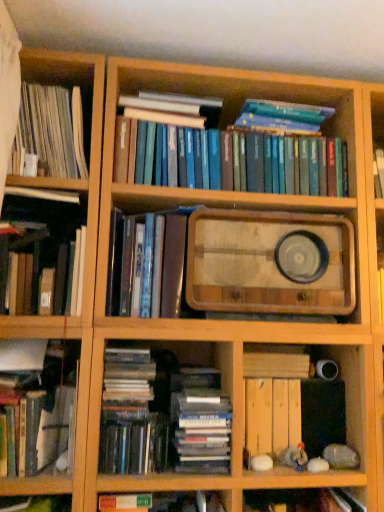
Question: Is hardcover books at center, the third book when ordered from bottom to top, to the left of hardcover book at lower left, the 2th book in the bottom-to-top sequence, from the viewer's perspective?

Choices:
 (A) no
 (B) yes

Answer: (A)

Question: Is hardcover books at center, the 5th book from the top, behind hardcover book at lower left, which is counted as the sixth book, starting from the top?

Choices:
 (A) no
 (B) yes

Answer: (B)

Question: From a real-world perspective, is hardcover books at center, the 5th book from the top, located higher than hardcover book at lower left, which is counted as the sixth book, starting from the top?

Choices:
 (A) yes
 (B) no

Answer: (A)

Question: From the image's perspective, is hardcover books at center, the third book when ordered from bottom to top, above hardcover book at lower left, which is counted as the sixth book, starting from the top?

Choices:
 (A) no
 (B) yes

Answer: (B)

Question: Is hardcover book at lower left, the 2th book in the bottom-to-top sequence, inside hardcover books at center, the 5th book from the top?

Choices:
 (A) no
 (B) yes

Answer: (A)

Question: Considering the relative sizes of hardcover books at center, the third book when ordered from bottom to top, and hardcover book at lower left, which is counted as the sixth book, starting from the top, in the image provided, is hardcover books at center, the third book when ordered from bottom to top, bigger than hardcover book at lower left, which is counted as the sixth book, starting from the top,?

Choices:
 (A) yes
 (B) no

Answer: (A)

Question: From the image's perspective, is shiny metallic book at center, which ranks as the 4th book in top-to-bottom order, located above hardcover books at center, the 5th book from the top?

Choices:
 (A) yes
 (B) no

Answer: (A)

Question: Does shiny metallic book at center, which ranks as the 4th book in top-to-bottom order, turn towards hardcover books at center, the 5th book from the top?

Choices:
 (A) yes
 (B) no

Answer: (B)

Question: From the image's perspective, does shiny metallic book at center, which ranks as the 4th book in top-to-bottom order, appear lower than hardcover books at center, the 5th book from the top?

Choices:
 (A) yes
 (B) no

Answer: (B)

Question: Does shiny metallic book at center, which ranks as the 4th book in top-to-bottom order, have a lesser height compared to hardcover books at center, the 5th book from the top?

Choices:
 (A) no
 (B) yes

Answer: (A)

Question: Does shiny metallic book at center, which ranks as the 4th book in top-to-bottom order, have a larger size compared to hardcover books at center, the 5th book from the top?

Choices:
 (A) yes
 (B) no

Answer: (A)

Question: From a real-world perspective, is shiny metallic book at center, the fourth book when ordered from bottom to top, physically below hardcover books at center, the 5th book from the top?

Choices:
 (A) yes
 (B) no

Answer: (B)

Question: Considering the relative positions of wooden tray at center and shiny black book at lower left, the seventh book positioned from the top, in the image provided, is wooden tray at center to the left of shiny black book at lower left, the seventh book positioned from the top, from the viewer's perspective?

Choices:
 (A) no
 (B) yes

Answer: (A)